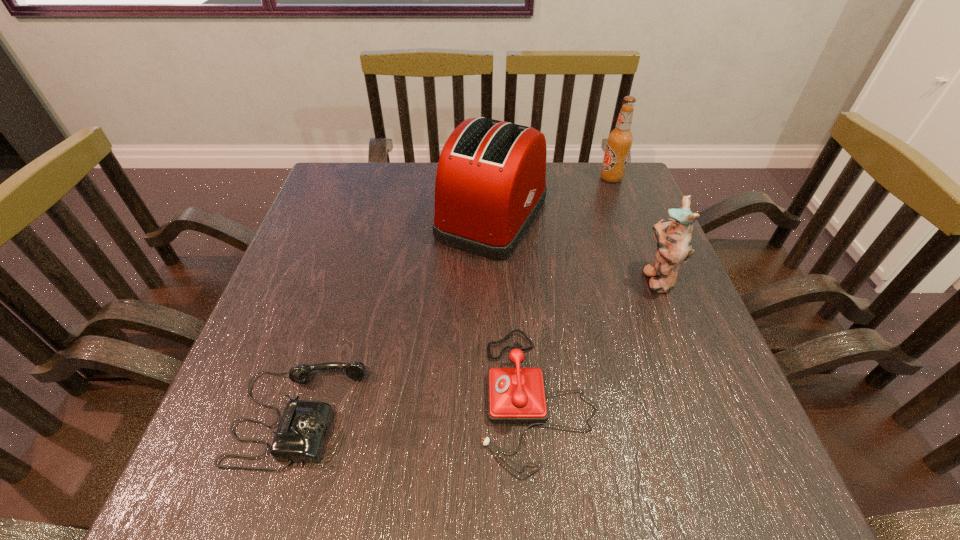
At what (x,y) coordinates should I click in order to perform the action: click on free location located 0.170m on the front-facing side of the figurine. Please return your answer as a coordinate pair (x, y). The image size is (960, 540). Looking at the image, I should click on (565, 278).

Image resolution: width=960 pixels, height=540 pixels. In order to click on vacant area situated on the front-facing side of the figurine in this screenshot , I will do `click(614, 278)`.

Find the location of a particular element. The image size is (960, 540). free location located 0.400m on the dial of the right telephone is located at coordinates (252, 396).

Find the location of `blank area located 0.150m on the dial of the right telephone`. blank area located 0.150m on the dial of the right telephone is located at coordinates (396, 396).

Image resolution: width=960 pixels, height=540 pixels. In order to click on vacant space located on the dial of the right telephone in this screenshot , I will do `click(407, 396)`.

Where is `free point located 0.310m on the dial of the left telephone`? The height and width of the screenshot is (540, 960). free point located 0.310m on the dial of the left telephone is located at coordinates (543, 415).

You are a GUI agent. You are given a task and a screenshot of the screen. Output one action in this format:
    pyautogui.click(x=<x>, y=<y>)
    Task: Click on the toaster that is at the far edge
    This screenshot has width=960, height=540.
    Given the screenshot: What is the action you would take?
    pyautogui.click(x=490, y=184)

I want to click on beer bottle located in the far edge section of the desktop, so click(619, 141).

Locate an element on the screen. object that is at the left edge is located at coordinates (301, 435).

Find the location of a particular element. This screenshot has height=540, width=960. beer bottle that is at the right edge is located at coordinates (619, 141).